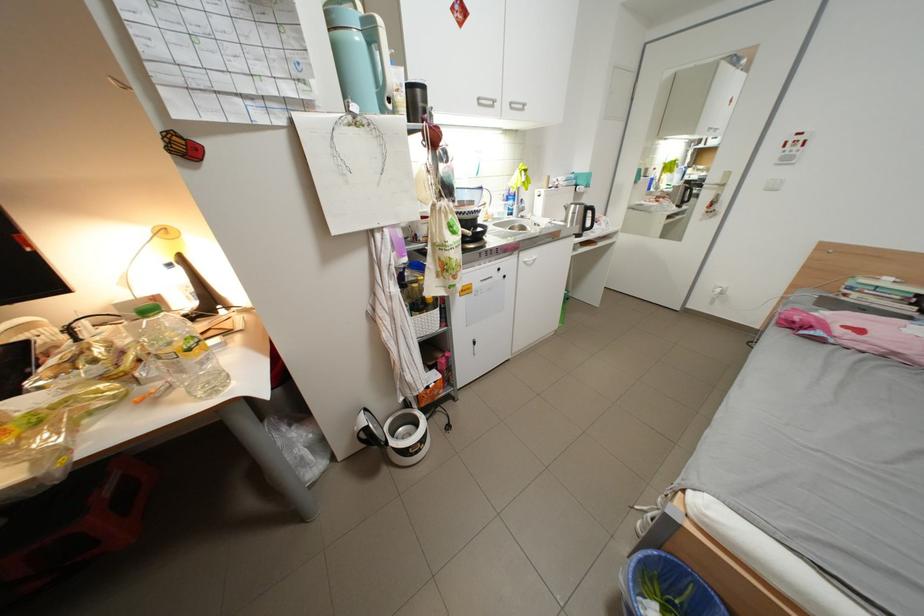
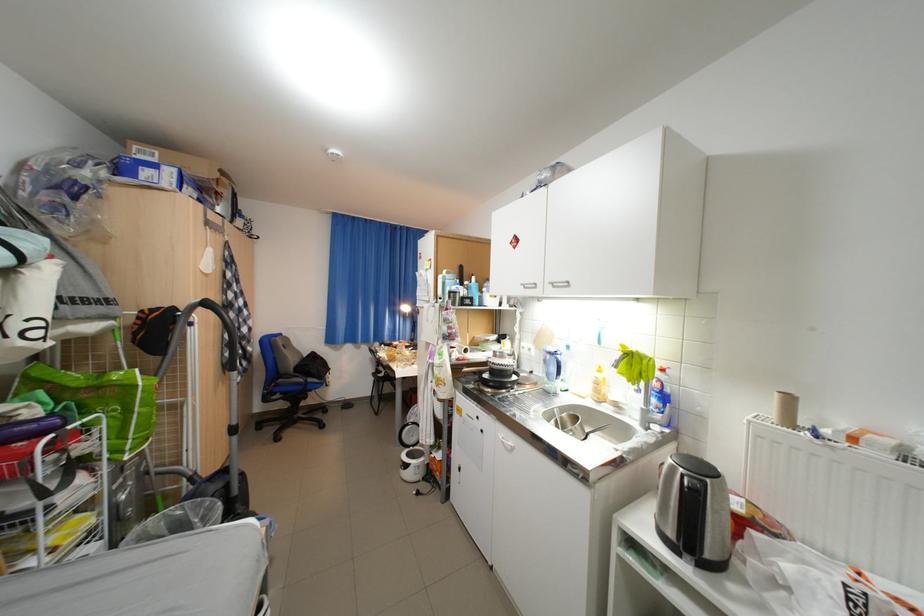
Where in the second image is the point corresponding to [523,105] from the first image?

(564, 285)